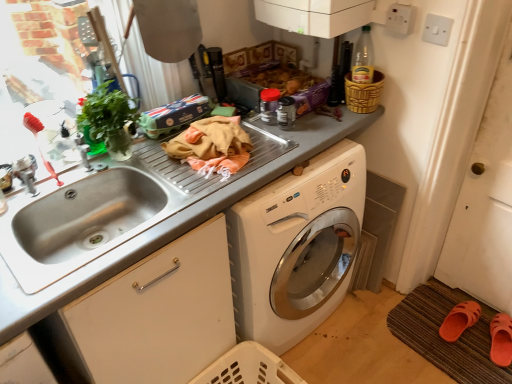
Image resolution: width=512 pixels, height=384 pixels. Find the location of `free spot to the left of brown woven mat at lower right`. free spot to the left of brown woven mat at lower right is located at coordinates (366, 344).